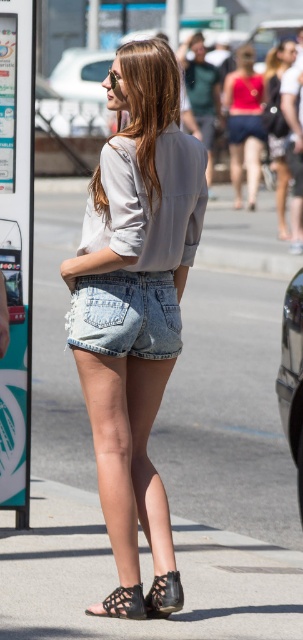
Does matte gray shirt at upper center appear on the right side of matte pink tank top at upper center?

Incorrect, matte gray shirt at upper center is not on the right side of matte pink tank top at upper center.

Who is positioned more to the left, matte gray shirt at upper center or matte pink tank top at upper center?

matte gray shirt at upper center

Describe the element at coordinates (149, 100) in the screenshot. I see `matte gray shirt at upper center` at that location.

Where is `matte gray shirt at upper center`? The height and width of the screenshot is (640, 303). matte gray shirt at upper center is located at coordinates (149, 100).

Looking at this image, who is shorter, denim shorts at center or matte gray shirt at upper center?

matte gray shirt at upper center

Is point (136, 156) closer to viewer compared to point (177, 70)?

That is True.

At what (x,y) coordinates should I click in order to perform the action: click on denim shorts at center. Please return your answer as a coordinate pair (x, y). This screenshot has height=640, width=303. Looking at the image, I should click on (136, 291).

Looking at this image, measure the distance from matte gray shirt at upper center to black leather sandal at lower center.

matte gray shirt at upper center and black leather sandal at lower center are 8.68 feet apart.

Is matte gray shirt at upper center taller than black leather sandal at lower center?

Yes, matte gray shirt at upper center is taller than black leather sandal at lower center.

What do you see at coordinates (149, 100) in the screenshot?
I see `matte gray shirt at upper center` at bounding box center [149, 100].

Where is `matte gray shirt at upper center`? This screenshot has width=303, height=640. matte gray shirt at upper center is located at coordinates (149, 100).